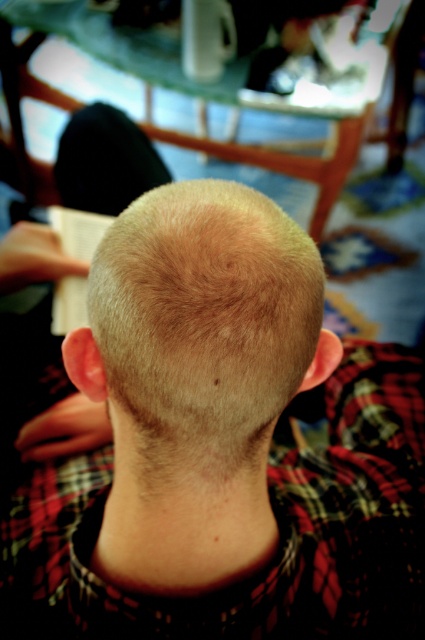
Question: Does blonde hair at center have a lesser width compared to blonde smooth hair at center?

Choices:
 (A) no
 (B) yes

Answer: (A)

Question: Does blonde hair at center have a larger size compared to blonde smooth hair at center?

Choices:
 (A) yes
 (B) no

Answer: (A)

Question: Does blonde hair at center appear over blonde smooth hair at center?

Choices:
 (A) yes
 (B) no

Answer: (B)

Question: Which point is farther from the camera taking this photo?

Choices:
 (A) (95, 532)
 (B) (119, 376)

Answer: (A)